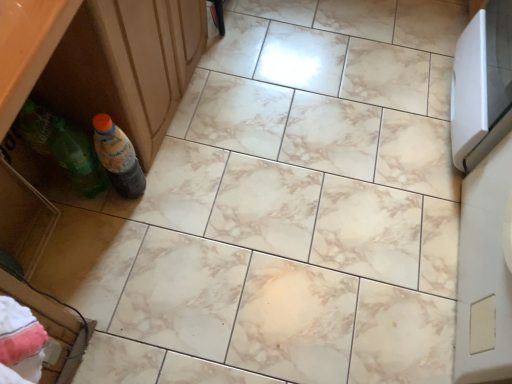
Question: Would you say green plastic drawer at lower left is to the left or to the right of translucent plastic bottle at lower left in the picture?

Choices:
 (A) right
 (B) left

Answer: (B)

Question: Looking at their shapes, would you say green plastic drawer at lower left is wider or thinner than translucent plastic bottle at lower left?

Choices:
 (A) wide
 (B) thin

Answer: (A)

Question: Relative to translucent plastic bottle at lower left, is green plastic drawer at lower left in front or behind?

Choices:
 (A) behind
 (B) front

Answer: (B)

Question: Considering the positions of translucent plastic bottle at lower left and green plastic drawer at lower left in the image, is translucent plastic bottle at lower left bigger or smaller than green plastic drawer at lower left?

Choices:
 (A) small
 (B) big

Answer: (A)

Question: Is translucent plastic bottle at lower left in front of or behind green plastic drawer at lower left in the image?

Choices:
 (A) behind
 (B) front

Answer: (A)

Question: Which is correct: translucent plastic bottle at lower left is inside green plastic drawer at lower left, or outside of it?

Choices:
 (A) inside
 (B) outside

Answer: (B)

Question: Looking at their shapes, would you say translucent plastic bottle at lower left is wider or thinner than green plastic drawer at lower left?

Choices:
 (A) wide
 (B) thin

Answer: (B)